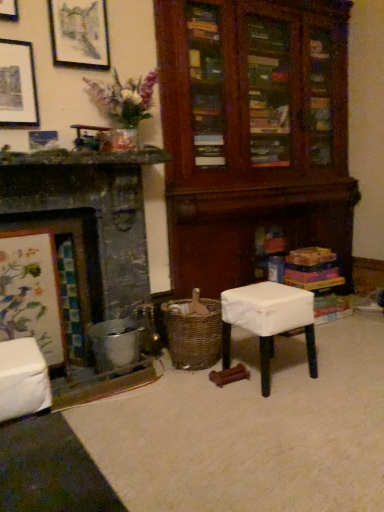
Question: Relative to metallic silver picture frame at upper left, which is the third picture frame in top-to-bottom order, is white fabric-covered stool at center in front or behind?

Choices:
 (A) behind
 (B) front

Answer: (B)

Question: Considering the positions of white fabric-covered stool at center and metallic silver picture frame at upper left, which is the first picture frame from bottom to top, in the image, is white fabric-covered stool at center wider or thinner than metallic silver picture frame at upper left, which is the first picture frame from bottom to top,?

Choices:
 (A) wide
 (B) thin

Answer: (A)

Question: Which object is positioned closest to the woven brown basket at lower center?

Choices:
 (A) matte black picture frame at upper left, the 1th picture frame in the top-to-bottom sequence
 (B) matte black picture frame at upper left, marked as the 2th picture frame in a bottom-to-top arrangement
 (C) metallic silver fireplace at left
 (D) metallic silver picture frame at upper left, which is the third picture frame in top-to-bottom order
 (E) white fabric-covered stool at center

Answer: (E)

Question: Estimate the real-world distances between objects in this image. Which object is closer to the white fabric-covered stool at center?

Choices:
 (A) woven brown basket at lower center
 (B) metallic silver fireplace at left
 (C) matte black picture frame at upper left, which appears as the 3th picture frame when ordered from the bottom
 (D) matte black picture frame at upper left, the 2th picture frame when ordered from top to bottom
 (E) metallic silver picture frame at upper left, which is the third picture frame in top-to-bottom order

Answer: (A)